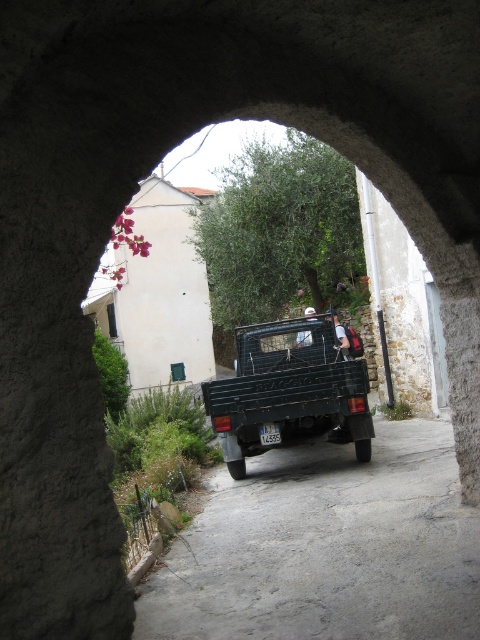
You are standing in front of the stone archway looking at the scene. There are two points marked in the image, point 1 at coordinates point (171, 616) and point 2 at coordinates point (284, 364). Which point is closer to you?

Point (171, 616) is closer to the viewer than point (284, 364).

You are driving a vehicle that is 2 meters wide. You come across a narrow path that leads to a historic archway. The path has a dark gray asphalt road at center and a green matte truck at center parked there. Can your vehicle pass through the path between them?

The dark gray asphalt road at center is thinner than the green matte truck at center, so the road is narrower than the truck. Since your vehicle is 2 meters wide, it cannot pass through the path between them because the road itself is narrower than the truck, indicating insufficient space.

You are a delivery driver who needs to park your truck on the dark gray asphalt road at center. According to the scene, where should you position your green matte truck at center relative to the road?

The dark gray asphalt road at center is located below the green matte truck at center, so you should position the green matte truck at center above the road to ensure proper parking.